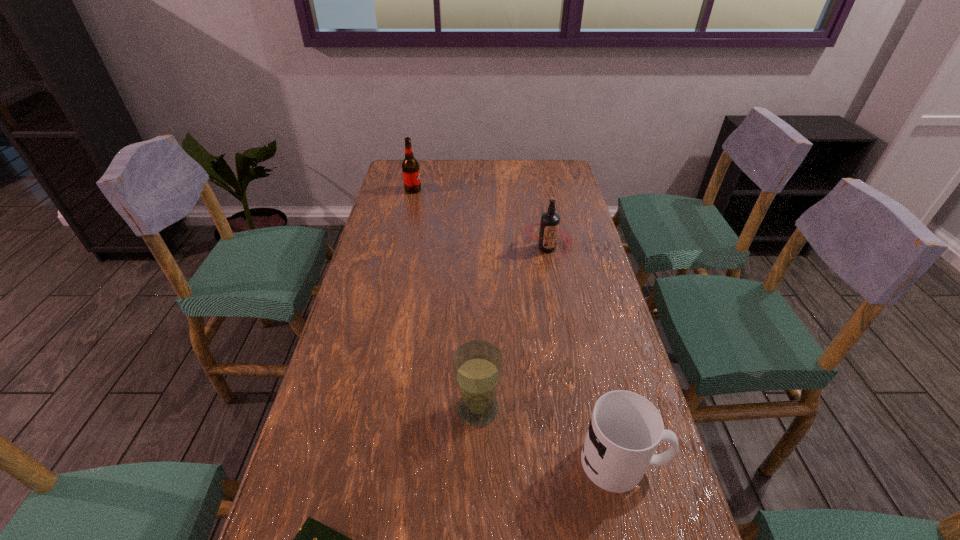
At what (x,y) coordinates should I click in order to perform the action: click on object situated at the far edge. Please return your answer as a coordinate pair (x, y). The image size is (960, 540). Looking at the image, I should click on (410, 167).

Identify the location of object present at the left edge. tap(410, 167).

I want to click on root beer located in the right edge section of the desktop, so click(x=549, y=226).

Find the location of a particular element. This screenshot has width=960, height=540. mug at the right edge is located at coordinates coord(625,429).

Identify the location of object at the far left corner. The image size is (960, 540). click(410, 167).

Where is `free region at the far edge`? This screenshot has width=960, height=540. free region at the far edge is located at coordinates (469, 166).

The image size is (960, 540). Find the location of `free space at the left edge of the desktop`. free space at the left edge of the desktop is located at coordinates [x=369, y=233].

The image size is (960, 540). In order to click on free region at the right edge of the desktop in this screenshot , I will do `click(560, 287)`.

You are a GUI agent. You are given a task and a screenshot of the screen. Output one action in this format:
    pyautogui.click(x=<x>, y=<y>)
    Task: Click on the free area in between the fourth farthest object and the third object from left to right
    The image size is (960, 540).
    Given the screenshot: What is the action you would take?
    [550, 435]

Find the location of `vacant region between the farthest object and the right root beer`. vacant region between the farthest object and the right root beer is located at coordinates (480, 219).